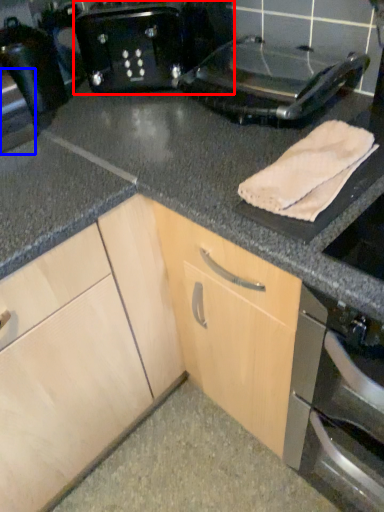
Question: Among these objects, which one is nearest to the camera, toaster (highlighted by a red box) or appliance (highlighted by a blue box)?

Choices:
 (A) toaster
 (B) appliance

Answer: (B)